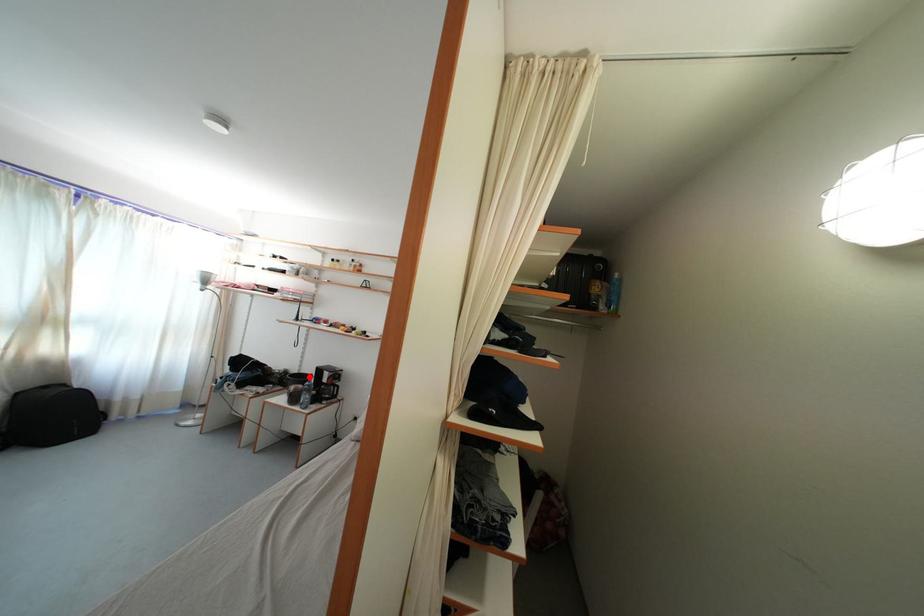
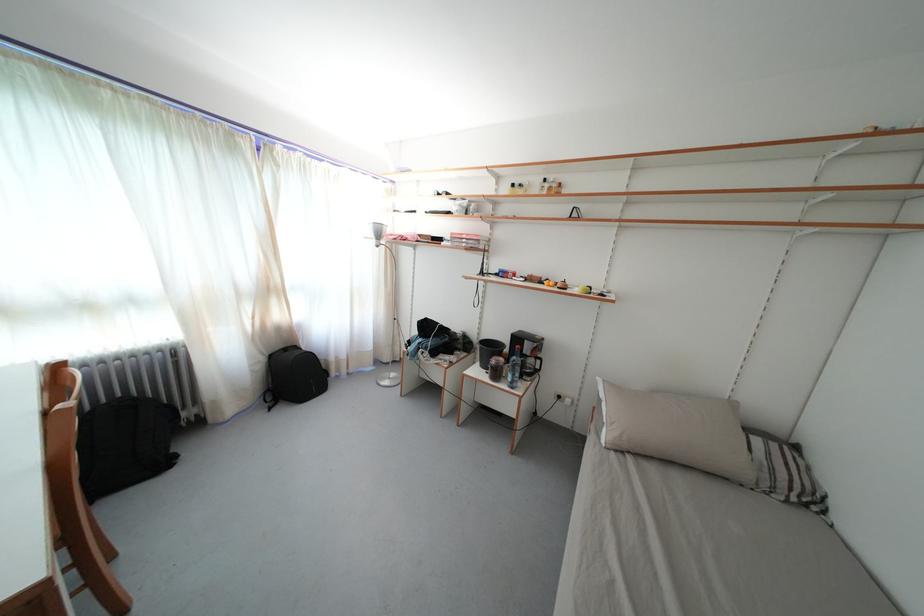
Question: A red point is marked in image1. In image2, is the corresponding 3D point closer to the camera or farther? Reply with the corresponding letter.

Choices:
 (A) The corresponding 3D point is closer.
 (B) The corresponding 3D point is farther.

Answer: (A)